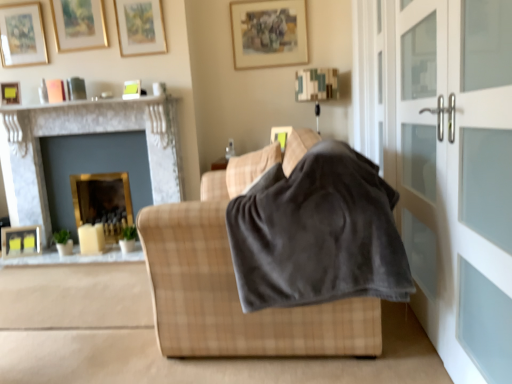
Question: From a real-world perspective, is satin white screen door at right, which appears as the second screen door when viewed from the back, above or below gold-framed picture at upper left, the 4th picture frame in the top-to-bottom sequence?

Choices:
 (A) above
 (B) below

Answer: (B)

Question: Is point (501, 23) positioned closer to the camera than point (12, 21)?

Choices:
 (A) farther
 (B) closer

Answer: (B)

Question: Estimate the real-world distances between objects in this image. Which object is closer to the wooden framed artwork at upper center, positioned as the second picture frame in right-to-left order?

Choices:
 (A) satin white screen door at right, which appears as the second screen door when viewed from the back
 (B) gold-framed mirror at left, the second fireplace in the left-to-right sequence
 (C) matte black picture frame at lower left, marked as the 7th picture frame in a top-to-bottom arrangement
 (D) gold-framed picture at upper left, the 6th picture frame positioned from the right
 (E) matte gold picture frame at center, arranged as the 2th picture frame when ordered from the bottom

Answer: (E)

Question: Which of these objects is positioned farthest from the matte yellow picture frame at upper left, the seventh picture frame when ordered from right to left?

Choices:
 (A) matte gold picture frame at upper center, which ranks as the third picture frame in right-to-left order
 (B) marble fireplace at left, the second fireplace viewed from the right
 (C) satin white screen door at right, which appears as the second screen door when viewed from the back
 (D) gray soft blanket at center
 (E) gold-framed picture at upper left, which appears as the second picture frame when viewed from the top

Answer: (C)